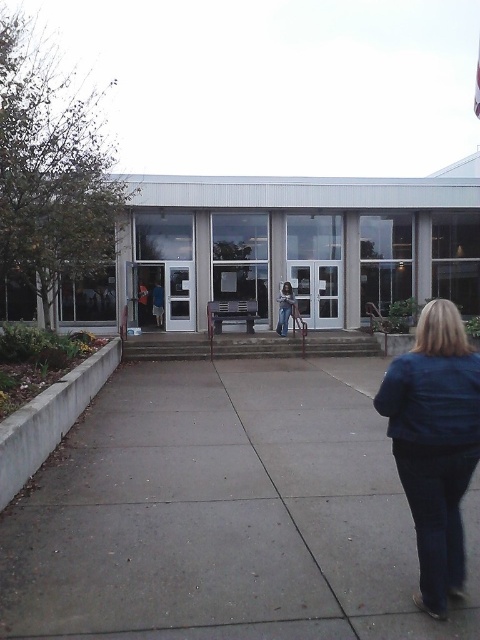
Is gray concrete pavement at center wider than clear glass storefront at center?

No.

Between gray concrete pavement at center and clear glass storefront at center, which one is positioned higher?

Positioned higher is clear glass storefront at center.

Which is in front, point (159, 593) or point (396, 285)?

Point (159, 593) is in front.

Locate an element on the screen. gray concrete pavement at center is located at coordinates (223, 515).

Which is more to the right, clear glass storefront at center or blue jeans at center?

Positioned to the right is clear glass storefront at center.

Can you confirm if clear glass storefront at center is taller than blue jeans at center?

Indeed, clear glass storefront at center has a greater height compared to blue jeans at center.

You are a GUI agent. You are given a task and a screenshot of the screen. Output one action in this format:
    pyautogui.click(x=<x>, y=<y>)
    Task: Click on the clear glass storefront at center
    The height and width of the screenshot is (640, 480).
    Given the screenshot: What is the action you would take?
    pyautogui.click(x=285, y=248)

Which is above, clear glass storefront at center or blue leather jacket at lower right?

clear glass storefront at center is above.

Between clear glass storefront at center and blue leather jacket at lower right, which one is positioned lower?

blue leather jacket at lower right is lower down.

Does point (81, 307) come farther from viewer compared to point (417, 332)?

That is True.

Identify the location of clear glass storefront at center. (285, 248).